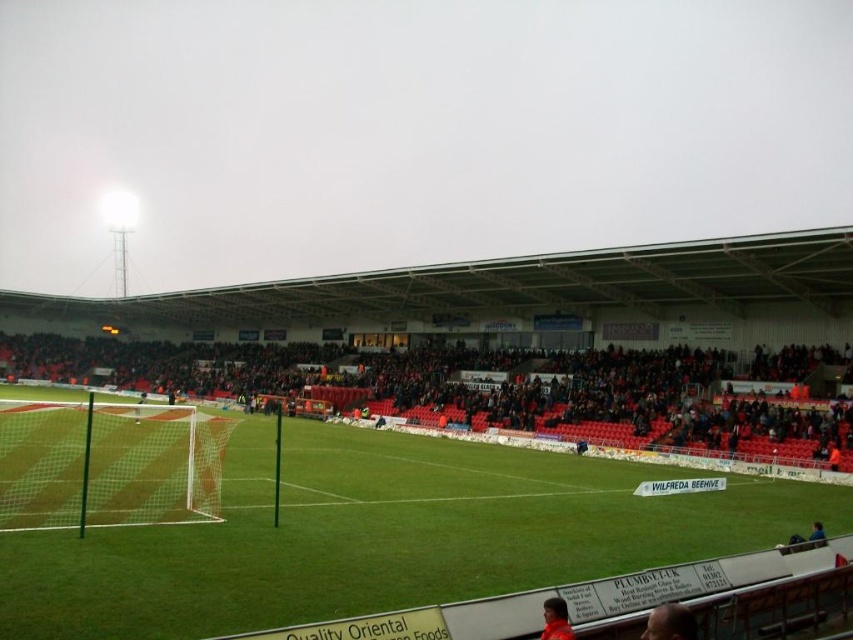
Question: Which point is farther to the camera?

Choices:
 (A) 566,616
 (B) 735,406
 (C) 689,624

Answer: (B)

Question: Is green grass football field at center to the right of smooth brown hair at lower right from the viewer's perspective?

Choices:
 (A) yes
 (B) no

Answer: (B)

Question: Can you confirm if smooth brown hair at lower right is wider than dark brown leather jacket at lower center?

Choices:
 (A) yes
 (B) no

Answer: (A)

Question: Is green grass football field at center smaller than smooth brown hair at lower right?

Choices:
 (A) yes
 (B) no

Answer: (B)

Question: Which point is farther to the camera?

Choices:
 (A) dark brown leather jacket at lower center
 (B) green grass football field at center
 (C) matte green net at left
 (D) smooth brown hair at lower right

Answer: (C)

Question: Among these objects, which one is farthest from the camera?

Choices:
 (A) smooth brown hair at lower right
 (B) matte green net at left
 (C) dark brown leather jacket at lower center

Answer: (B)